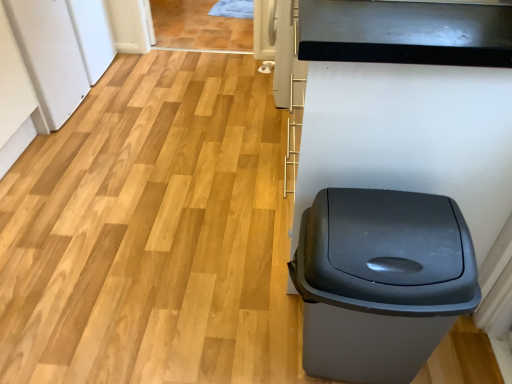
Question: From the image's perspective, would you say white matte refrigerator at left is shown under matte gray plastic trash can at right?

Choices:
 (A) yes
 (B) no

Answer: (B)

Question: Would you say white matte refrigerator at left is a long distance from matte gray plastic trash can at right?

Choices:
 (A) yes
 (B) no

Answer: (A)

Question: Can you confirm if white matte refrigerator at left is smaller than matte gray plastic trash can at right?

Choices:
 (A) no
 (B) yes

Answer: (A)

Question: Does white matte refrigerator at left lie in front of matte gray plastic trash can at right?

Choices:
 (A) no
 (B) yes

Answer: (A)

Question: Is white matte refrigerator at left oriented away from matte gray plastic trash can at right?

Choices:
 (A) yes
 (B) no

Answer: (B)

Question: Is white matte refrigerator at left beside matte gray plastic trash can at right?

Choices:
 (A) no
 (B) yes

Answer: (A)

Question: Considering the relative positions of matte gray plastic trash can at right and white matte refrigerator at left in the image provided, is matte gray plastic trash can at right behind white matte refrigerator at left?

Choices:
 (A) no
 (B) yes

Answer: (A)

Question: From a real-world perspective, is matte gray plastic trash can at right physically below white matte refrigerator at left?

Choices:
 (A) no
 (B) yes

Answer: (B)

Question: Can white matte refrigerator at left be found inside matte gray plastic trash can at right?

Choices:
 (A) yes
 (B) no

Answer: (B)

Question: Is matte gray plastic trash can at right oriented towards white matte refrigerator at left?

Choices:
 (A) yes
 (B) no

Answer: (B)

Question: Can you confirm if matte gray plastic trash can at right is shorter than white matte refrigerator at left?

Choices:
 (A) yes
 (B) no

Answer: (A)

Question: Is matte gray plastic trash can at right outside of white matte refrigerator at left?

Choices:
 (A) no
 (B) yes

Answer: (B)

Question: Based on their sizes in the image, would you say white matte refrigerator at left is bigger or smaller than matte gray plastic trash can at right?

Choices:
 (A) big
 (B) small

Answer: (A)